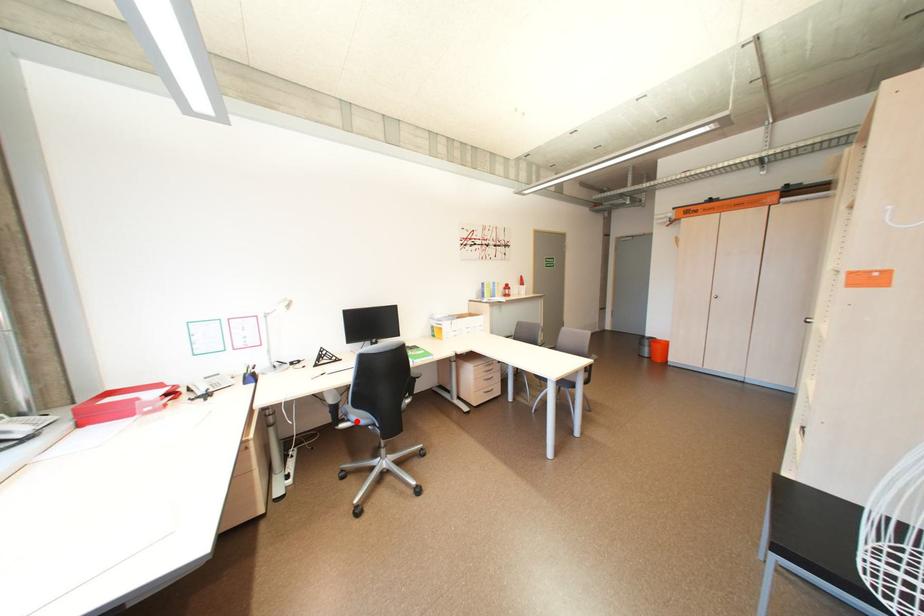
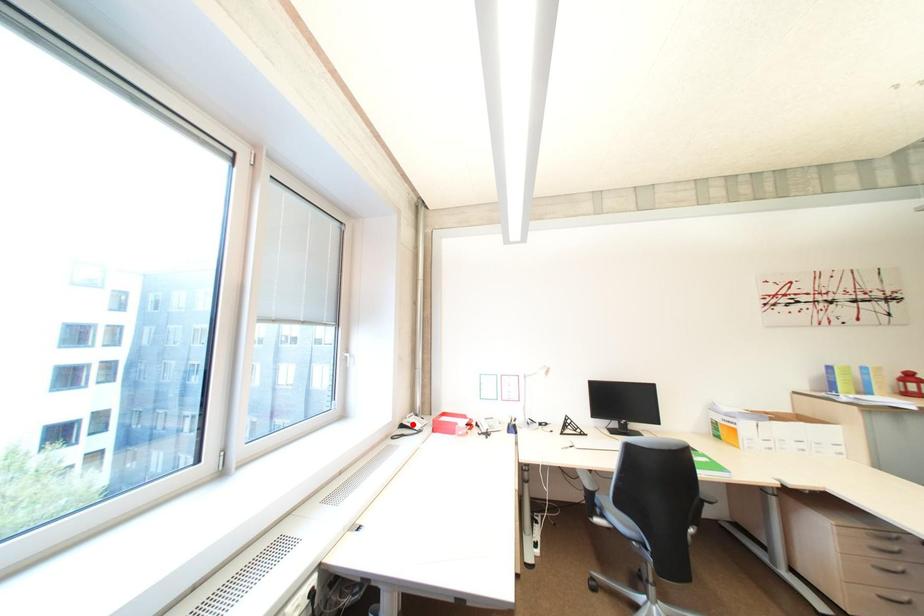
I am providing you with two images of the same scene from different viewpoints. A red point is marked on the first image and another point is marked on the second image. Is the red point in image1 aligned with the point shown in image2?

No